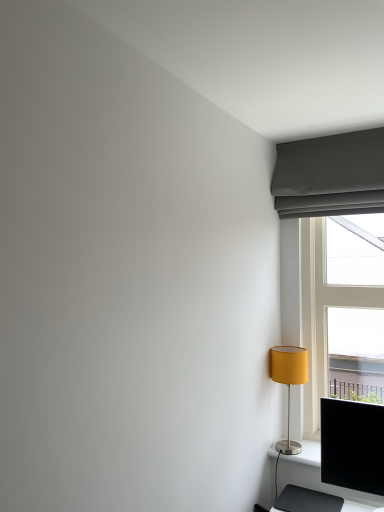
Question: Is matte yellow fabric lampshade at right to the left or to the right of matte gray curtain at upper right in the image?

Choices:
 (A) right
 (B) left

Answer: (B)

Question: From a real-world perspective, is matte yellow fabric lampshade at right above or below matte gray curtain at upper right?

Choices:
 (A) below
 (B) above

Answer: (A)

Question: Estimate the real-world distances between objects in this image. Which object is farther from the matte yellow fabric lampshade at right?

Choices:
 (A) white plastic window at right
 (B) black glossy computer monitor at lower right
 (C) matte gray curtain at upper right

Answer: (C)

Question: Which is nearer to the white plastic window at right?

Choices:
 (A) black glossy computer monitor at lower right
 (B) matte yellow fabric lampshade at right
 (C) matte gray curtain at upper right

Answer: (C)